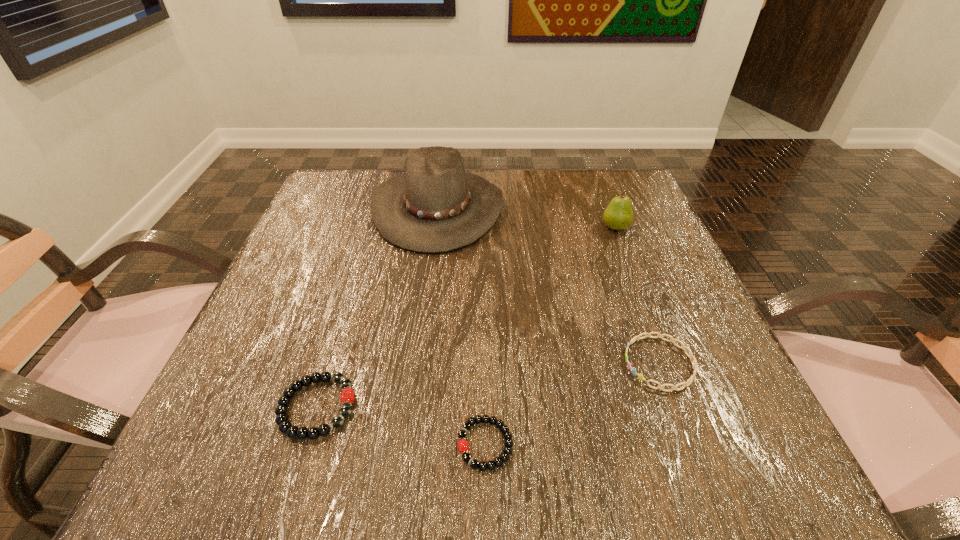
At what (x,y) coordinates should I click in order to perform the action: click on vacant space located 0.330m on the surface of the rightmost bracelet showing star-shaped elements. Please return your answer as a coordinate pair (x, y). This screenshot has width=960, height=540. Looking at the image, I should click on (420, 363).

I want to click on vacant space positioned on the surface of the rightmost bracelet showing star-shaped elements, so click(444, 363).

This screenshot has height=540, width=960. Find the location of `vacant area situated 0.140m on the surface of the rightmost bracelet showing star-shaped elements`. vacant area situated 0.140m on the surface of the rightmost bracelet showing star-shaped elements is located at coordinates (538, 363).

You are a GUI agent. You are given a task and a screenshot of the screen. Output one action in this format:
    pyautogui.click(x=<x>, y=<y>)
    Task: Click on the free spot located on the back of the shortest bracelet
    The height and width of the screenshot is (540, 960).
    Given the screenshot: What is the action you would take?
    pyautogui.click(x=484, y=265)

I want to click on hat that is at the far edge, so click(x=436, y=207).

This screenshot has width=960, height=540. What are the coordinates of `pear located in the far edge section of the desktop` in the screenshot? It's located at (618, 215).

Where is `hat that is at the left edge`? This screenshot has width=960, height=540. hat that is at the left edge is located at coordinates (436, 207).

This screenshot has height=540, width=960. I want to click on bracelet positioned at the left edge, so click(x=285, y=426).

This screenshot has width=960, height=540. Identify the location of pear that is at the right edge. (618, 215).

Find the location of a particular element. The image size is (960, 540). bracelet that is at the right edge is located at coordinates 694,364.